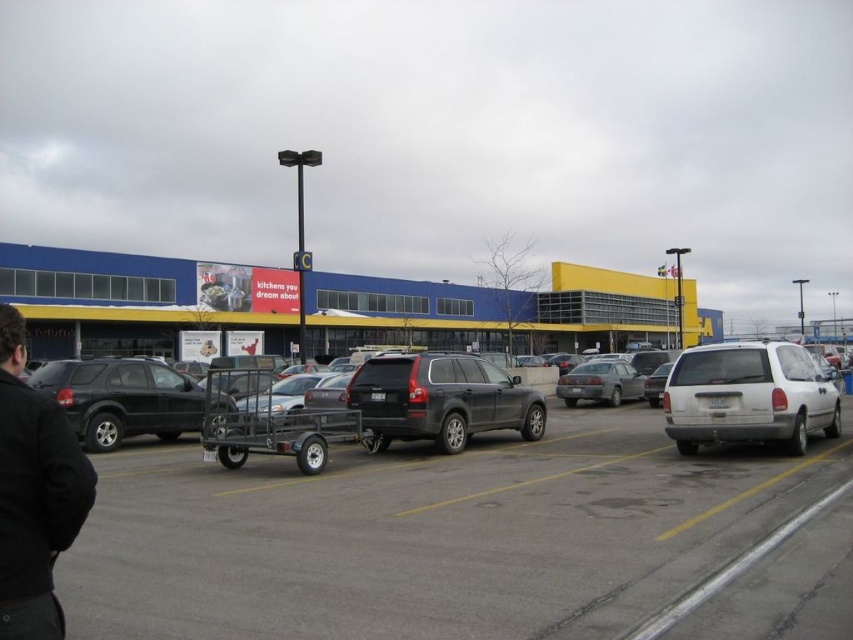
You are a delivery driver who needs to park your compact car between the white matte minivan at right and the matte black suv at left in the parking lot. Based on their sizes, which vehicle should you park closer to in order to fit your car comfortably?

The white matte minivan at right occupies less space than the matte black suv at left, so you should park closer to the white matte minivan at right to ensure there is enough space for your compact car.

You are a delivery driver who needs to park your truck between the white matte minivan at right and the silver metallic sedan at center. Your truck is 2.1 meters wide. Can you fit your truck between them if the space between the two vehicles is 2.2 meters?

The space between the white matte minivan at right and the silver metallic sedan at center is 2.2 meters. Since your truck is 2.1 meters wide, it should fit comfortably between them as there is enough space.

You are standing at the entrance of the store and want to walk to the point labeled as point 2. There are two points marked in the parking lot, point 1 at coordinates point (689, 406) and point 2 at coordinates point (612, 397). Which point should you head towards if you want to reach the one that is closer to you?

You should head towards point (689, 406) because it is closer to the viewer than point (612, 397).